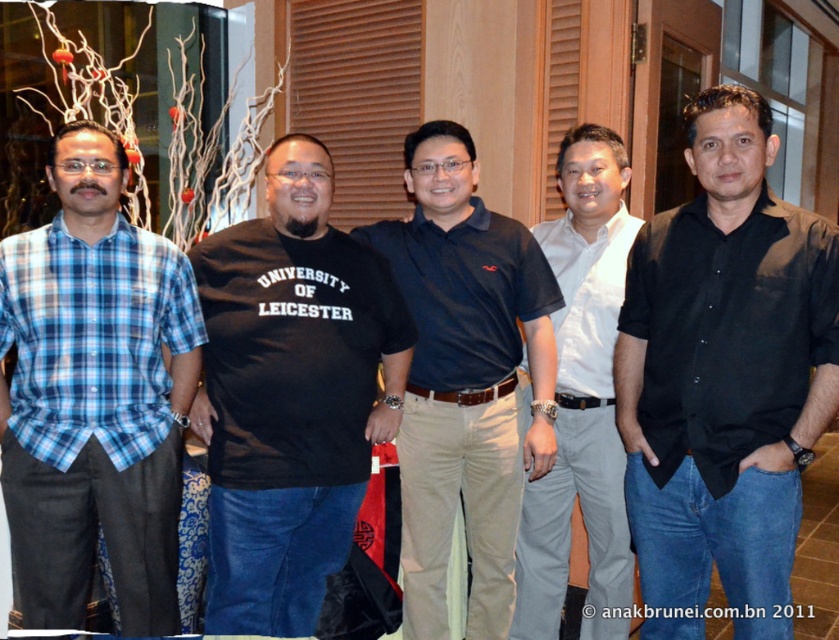
Looking at this image, does dark blue cotton polo shirt at center appear over white cotton shirt at center?

Yes, dark blue cotton polo shirt at center is above white cotton shirt at center.

Describe the element at coordinates (465, 380) in the screenshot. The width and height of the screenshot is (839, 640). I see `dark blue cotton polo shirt at center` at that location.

Who is more forward, (441, 269) or (555, 480)?

Positioned in front is point (441, 269).

Find the location of a particular element. dark blue cotton polo shirt at center is located at coordinates (465, 380).

Can you confirm if black cotton t-shirt at center is shorter than white cotton shirt at center?

Indeed, black cotton t-shirt at center has a lesser height compared to white cotton shirt at center.

Looking at this image, who is shorter, black cotton t-shirt at center or white cotton shirt at center?

black cotton t-shirt at center

Locate an element on the screen. black cotton t-shirt at center is located at coordinates (290, 394).

Where is `black cotton t-shirt at center`? The image size is (839, 640). black cotton t-shirt at center is located at coordinates (290, 394).

The height and width of the screenshot is (640, 839). Describe the element at coordinates (723, 378) in the screenshot. I see `black smooth shirt at right` at that location.

Does point (655, 429) come farther from viewer compared to point (465, 289)?

No.

Locate an element on the screen. This screenshot has height=640, width=839. black smooth shirt at right is located at coordinates (723, 378).